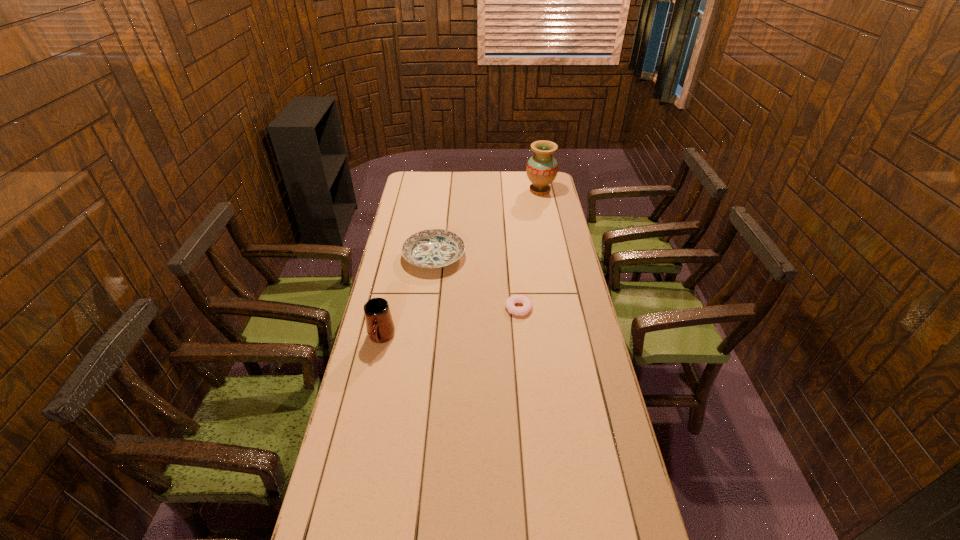
Locate an element on the screen. The height and width of the screenshot is (540, 960). free space located on the front of the plate is located at coordinates (429, 292).

Locate an element on the screen. Image resolution: width=960 pixels, height=540 pixels. vacant space situated 0.150m on the front of the shortest object is located at coordinates (522, 350).

Image resolution: width=960 pixels, height=540 pixels. What are the coordinates of `object that is at the far edge` in the screenshot? It's located at (542, 168).

Find the location of a particular element. This screenshot has height=540, width=960. mug located in the left edge section of the desktop is located at coordinates (380, 327).

What are the coordinates of `plate located in the left edge section of the desktop` in the screenshot? It's located at (433, 248).

Where is `object at the right edge`? The height and width of the screenshot is (540, 960). object at the right edge is located at coordinates (542, 168).

At what (x,y) coordinates should I click in order to perform the action: click on object positioned at the far right corner. Please return your answer as a coordinate pair (x, y). Looking at the image, I should click on (542, 168).

Locate an element on the screen. vacant space at the far edge of the desktop is located at coordinates (508, 185).

The width and height of the screenshot is (960, 540). In the image, there is a desktop. In order to click on vacant space at the left edge in this screenshot , I will do `click(368, 405)`.

You are a GUI agent. You are given a task and a screenshot of the screen. Output one action in this format:
    pyautogui.click(x=<x>, y=<y>)
    Task: Click on the free spot at the far left corner of the desktop
    
    Given the screenshot: What is the action you would take?
    pyautogui.click(x=426, y=173)